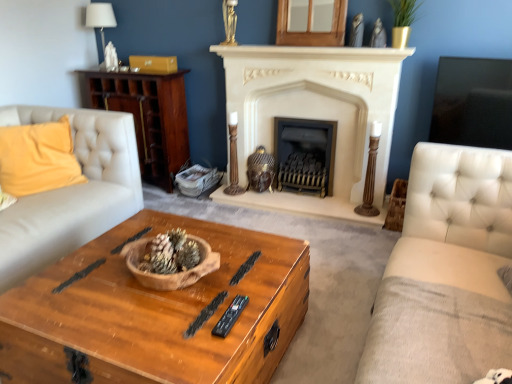
Locate an element on the screen. free space in front of brown textured pine cone at center is located at coordinates (146, 292).